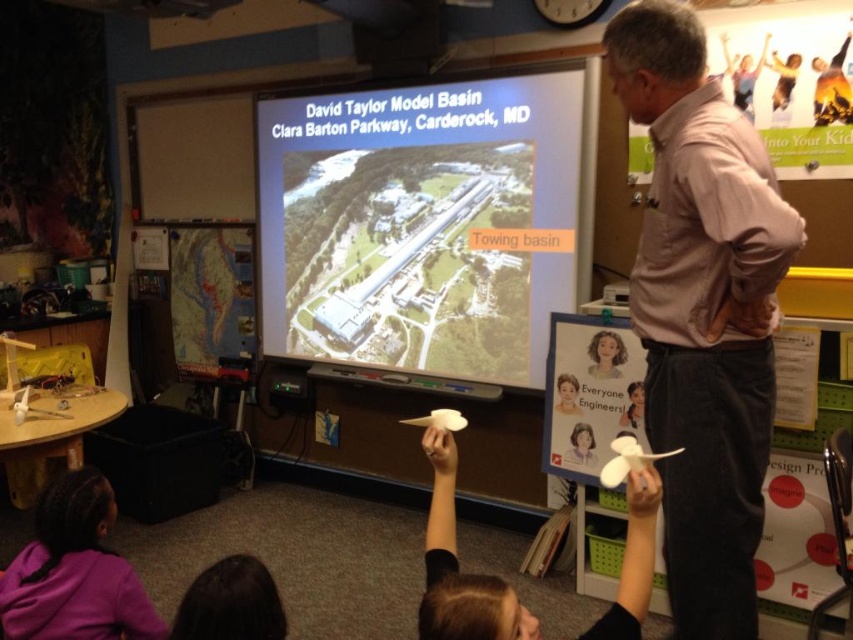
What do you see at coordinates (421, 225) in the screenshot?
I see `matte white projector screen at center` at bounding box center [421, 225].

Is point (461, 161) farther from camera compared to point (126, 632)?

That is True.

Is point (283, 118) behind point (73, 497)?

Yes.

Locate an element on the screen. The image size is (853, 640). matte white projector screen at center is located at coordinates [x=421, y=225].

Does white paper airplane at right appear under white paper airplane at center?

Actually, white paper airplane at right is above white paper airplane at center.

Measure the distance from white paper airplane at right to white paper airplane at center.

white paper airplane at right is 20.27 inches away from white paper airplane at center.

Measure the distance between point (686, 429) and camera.

Point (686, 429) and camera are 1.59 meters apart.

Where is `white paper airplane at right`? white paper airplane at right is located at coordinates (703, 310).

Is point (283, 202) farther from camera compared to point (434, 492)?

Yes, it is behind point (434, 492).

In the scene shown: Can you confirm if matte white projector screen at center is positioned above white paper airplane at center?

Yes.

Is point (289, 269) closer to viewer compared to point (492, 630)?

No, (289, 269) is behind (492, 630).

I want to click on matte white projector screen at center, so click(421, 225).